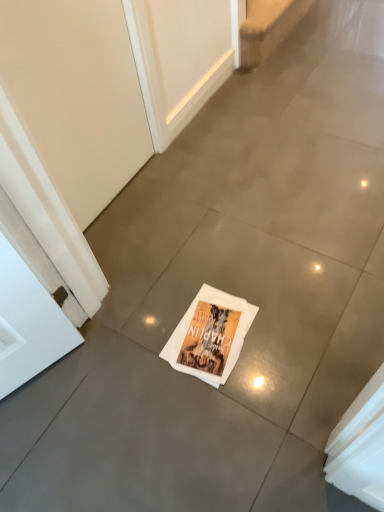
This screenshot has width=384, height=512. Describe the element at coordinates (210, 336) in the screenshot. I see `white paper magazine at center` at that location.

I want to click on beige matte screen door at upper left, so click(77, 95).

Find the location of a particular element. The height and width of the screenshot is (512, 384). white paper magazine at center is located at coordinates (210, 336).

Which is farther, (242, 51) or (194, 355)?

The point (242, 51) is farther from the camera.

Which of these two, beige carpet at upper center or white paper magazine at center, is bigger?

beige carpet at upper center.

Is beige carpet at upper center oriented towards white paper magazine at center?

No, beige carpet at upper center does not turn towards white paper magazine at center.

Would you say white paper magazine at center is to the left or to the right of beige carpet at upper center in the picture?

white paper magazine at center is positioned on beige carpet at upper center's left side.

Is point (189, 324) positioned after point (274, 17)?

No, it is not.

From the image's perspective, is white paper magazine at center above or below beige carpet at upper center?

white paper magazine at center is below beige carpet at upper center.

Which object is wider, white paper magazine at center or beige carpet at upper center?

beige carpet at upper center is wider.

Is point (169, 346) more distant than point (104, 20)?

Yes, it is behind point (104, 20).

Does white paper magazine at center have a smaller size compared to beige matte screen door at upper left?

Yes, white paper magazine at center is smaller than beige matte screen door at upper left.

Can you confirm if white paper magazine at center is taller than beige matte screen door at upper left?

In fact, white paper magazine at center may be shorter than beige matte screen door at upper left.

Are beige matte screen door at upper left and beige carpet at upper center beside each other?

No, beige matte screen door at upper left is not beside beige carpet at upper center.

Which is behind, point (53, 1) or point (262, 52)?

Positioned behind is point (262, 52).

From a real-world perspective, is beige matte screen door at upper left below beige carpet at upper center?

No, from a real-world perspective, beige matte screen door at upper left is not beneath beige carpet at upper center.

Does beige carpet at upper center appear on the right side of beige matte screen door at upper left?

Correct, you'll find beige carpet at upper center to the right of beige matte screen door at upper left.

Is beige carpet at upper center oriented towards beige matte screen door at upper left?

No.

Who is shorter, beige carpet at upper center or beige matte screen door at upper left?

Standing shorter between the two is beige carpet at upper center.

From the image's perspective, is beige carpet at upper center on beige matte screen door at upper left?

Yes, from the image's perspective, beige carpet at upper center is over beige matte screen door at upper left.

Is beige matte screen door at upper left to the left of white paper magazine at center from the viewer's perspective?

Indeed, beige matte screen door at upper left is positioned on the left side of white paper magazine at center.

Can you confirm if beige matte screen door at upper left is thinner than white paper magazine at center?

Correct, the width of beige matte screen door at upper left is less than that of white paper magazine at center.

Locate an element on the screen. screen door that appears on the left of white paper magazine at center is located at coordinates [77, 95].

Is point (50, 56) less distant than point (192, 333)?

Yes, it is.

Where is `stairwell behind the white paper magazine at center`? stairwell behind the white paper magazine at center is located at coordinates (268, 27).

Where is `magazine below the beige carpet at upper center (from the image's perspective)`? This screenshot has height=512, width=384. magazine below the beige carpet at upper center (from the image's perspective) is located at coordinates (210, 336).

When comparing their distances from beige matte screen door at upper left, does white paper magazine at center or beige carpet at upper center seem closer?

white paper magazine at center lies closer to beige matte screen door at upper left than the other object.

Which object lies further to the anchor point beige matte screen door at upper left, beige carpet at upper center or white paper magazine at center?

beige carpet at upper center is positioned further to the anchor beige matte screen door at upper left.

When comparing their distances from beige carpet at upper center, does white paper magazine at center or beige matte screen door at upper left seem further?

white paper magazine at center is positioned further to the anchor beige carpet at upper center.

Which object lies nearer to the anchor point white paper magazine at center, beige matte screen door at upper left or beige carpet at upper center?

beige matte screen door at upper left.

Which object lies nearer to the anchor point beige carpet at upper center, beige matte screen door at upper left or white paper magazine at center?

beige matte screen door at upper left lies closer to beige carpet at upper center than the other object.

From the image, which object appears to be nearer to white paper magazine at center, beige carpet at upper center or beige matte screen door at upper left?

beige matte screen door at upper left lies closer to white paper magazine at center than the other object.

Locate an element on the screen. This screenshot has height=512, width=384. screen door between beige carpet at upper center and white paper magazine at center in the up-down direction is located at coordinates (77, 95).